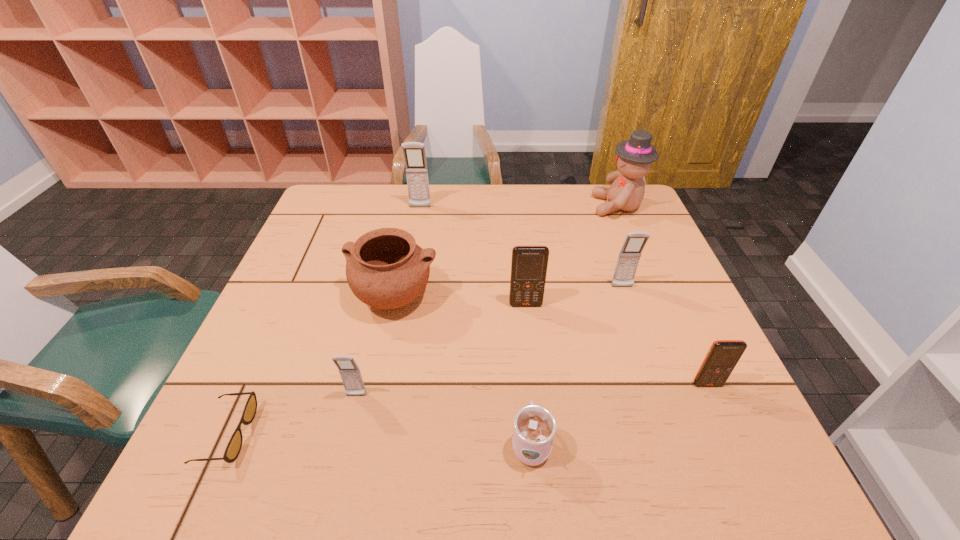
Where is `the nearest gray cellular telephone`? This screenshot has width=960, height=540. the nearest gray cellular telephone is located at coordinates (350, 373).

Identify the location of the smallest gray cellular telephone. The width and height of the screenshot is (960, 540). (350, 373).

The height and width of the screenshot is (540, 960). I want to click on cup, so click(534, 426).

Where is `the leftmost object`? the leftmost object is located at coordinates (233, 448).

Where is `sunglasses`? sunglasses is located at coordinates (233, 448).

Where is `vacant space located 0.230m on the front-facing side of the rag_doll`? vacant space located 0.230m on the front-facing side of the rag_doll is located at coordinates (519, 206).

Find the location of a particular element. This screenshot has width=960, height=540. vacant area situated on the front-facing side of the rag_doll is located at coordinates (548, 206).

Find the location of a particular element. free spot located on the front-facing side of the rag_doll is located at coordinates (545, 206).

What are the coordinates of `free location located 0.230m on the front-facing side of the biggest gray cellular telephone` in the screenshot? It's located at (411, 256).

Locate an element on the screen. This screenshot has height=540, width=960. vacant space located on the front-facing side of the second nearest gray cellular telephone is located at coordinates (665, 411).